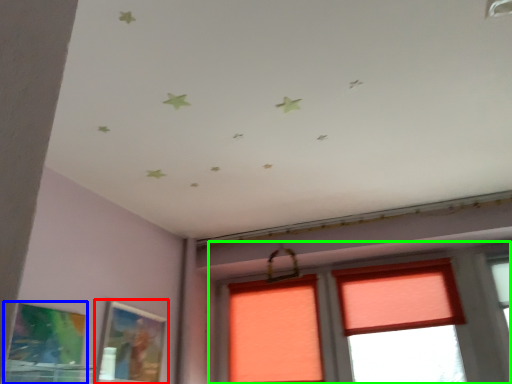
Question: Which object is the farthest from picture frame (highlighted by a red box)? Choose among these: picture frame (highlighted by a blue box) or window (highlighted by a green box).

Choices:
 (A) picture frame
 (B) window

Answer: (B)